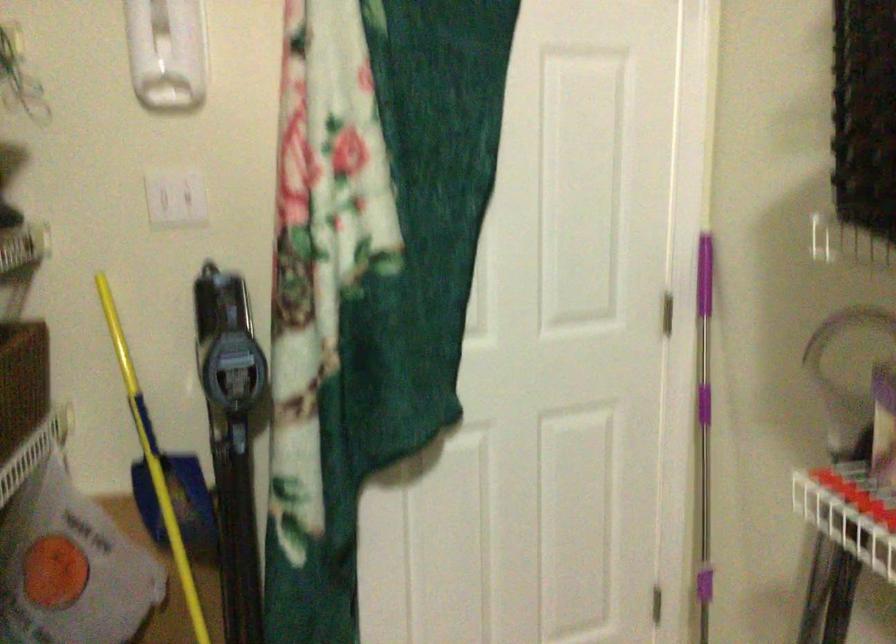
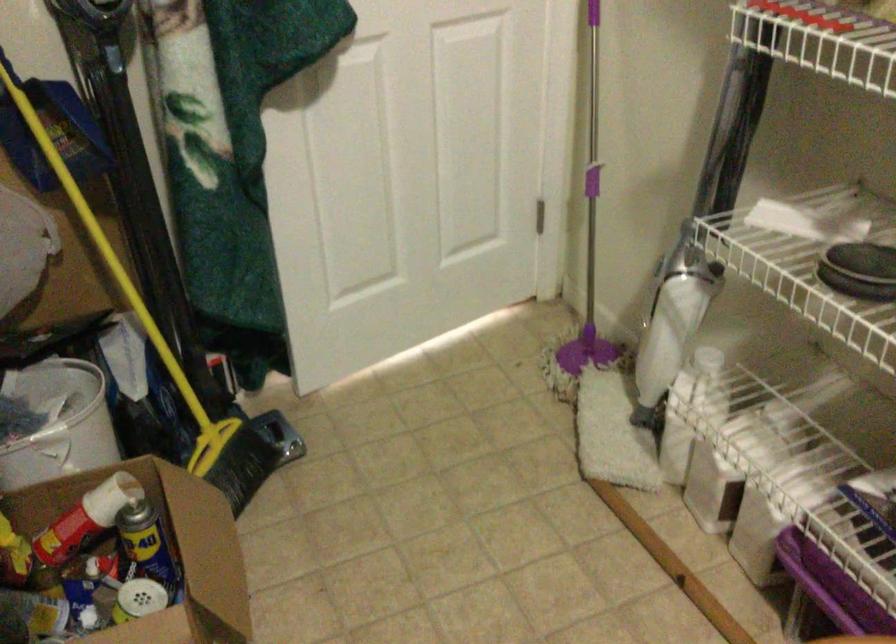
The point at (242, 505) is marked in the first image. Where is the corresponding point in the second image?

(135, 140)